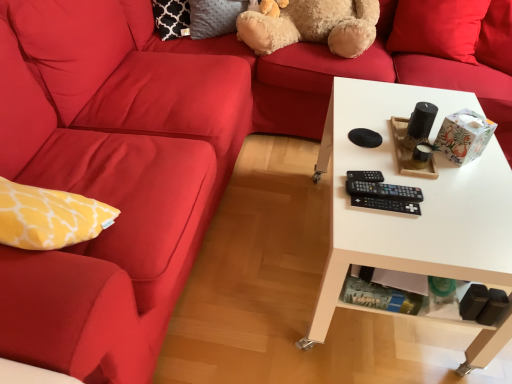
Question: Does black plastic remote at center, which ranks as the 2th control in back-to-front order, have a lesser height compared to red matte pillow at upper right?

Choices:
 (A) yes
 (B) no

Answer: (A)

Question: Does black plastic remote at center, which is the second control from front to back, touch red matte pillow at upper right?

Choices:
 (A) yes
 (B) no

Answer: (B)

Question: Considering the relative sizes of black plastic remote at center, which ranks as the 2th control in back-to-front order, and red matte pillow at upper right in the image provided, is black plastic remote at center, which ranks as the 2th control in back-to-front order, smaller than red matte pillow at upper right?

Choices:
 (A) yes
 (B) no

Answer: (A)

Question: Is black plastic remote at center, which is the second control from front to back, oriented towards red matte pillow at upper right?

Choices:
 (A) yes
 (B) no

Answer: (B)

Question: From a real-world perspective, is black plastic remote at center, which ranks as the 2th control in back-to-front order, located beneath red matte pillow at upper right?

Choices:
 (A) yes
 (B) no

Answer: (A)

Question: Visually, is fuzzy beige teddy bear at upper center positioned to the left or to the right of black plastic remote at center, which ranks as the 2th control in back-to-front order?

Choices:
 (A) right
 (B) left

Answer: (B)

Question: From a real-world perspective, is fuzzy beige teddy bear at upper center physically located above or below black plastic remote at center, which is the second control from front to back?

Choices:
 (A) below
 (B) above

Answer: (B)

Question: From the image's perspective, is fuzzy beige teddy bear at upper center above or below black plastic remote at center, which ranks as the 2th control in back-to-front order?

Choices:
 (A) above
 (B) below

Answer: (A)

Question: Is point (320, 36) closer or farther from the camera than point (409, 195)?

Choices:
 (A) closer
 (B) farther

Answer: (B)

Question: Considering their positions, is red matte pillow at upper right located in front of or behind matte red couch at left?

Choices:
 (A) front
 (B) behind

Answer: (B)

Question: Considering the relative positions of red matte pillow at upper right and matte red couch at left in the image provided, is red matte pillow at upper right to the left or to the right of matte red couch at left?

Choices:
 (A) right
 (B) left

Answer: (A)

Question: Is red matte pillow at upper right inside the boundaries of matte red couch at left, or outside?

Choices:
 (A) inside
 (B) outside

Answer: (B)

Question: Considering the positions of point (487, 6) and point (72, 153), is point (487, 6) closer or farther from the camera than point (72, 153)?

Choices:
 (A) closer
 (B) farther

Answer: (B)

Question: Is point (117, 264) closer or farther from the camera than point (318, 39)?

Choices:
 (A) closer
 (B) farther

Answer: (A)

Question: From the image's perspective, is matte red couch at left above or below fuzzy beige teddy bear at upper center?

Choices:
 (A) below
 (B) above

Answer: (A)